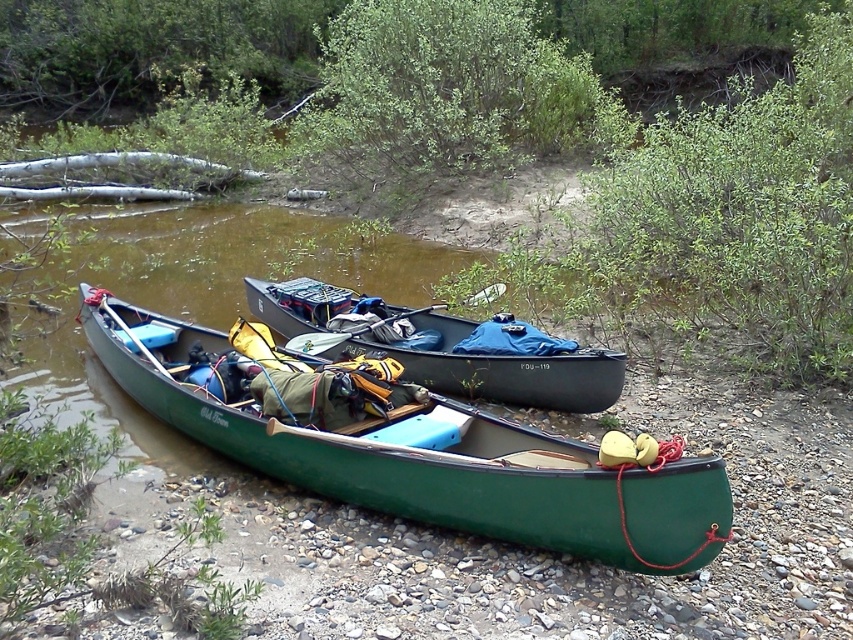
You are a hiker who wants to carry your wooden paddle at center to the nearby store. The path to the store is narrow and has a low clearance. The matte black canoe at center is blocking the path. Can you pass through the path without bending down or dropping the paddle?

The matte black canoe at center is bigger than the wooden paddle at center, so the path might be too narrow for the paddle to pass through without adjusting your grip. However, since the canoe is blocking the path, you might need to move it or find an alternative route.

You are a hiker who just arrived at the riverside and see the green matte canoe at lower left and the white plastic paddle at center. You want to pick up the paddle to load it into the canoe. Which direction should you move relative to the paddle to reach the canoe?

The green matte canoe at lower left is located below the white plastic paddle at center. To reach the canoe from the paddle, you should move downward from the paddle.

You are planning to carry the white plastic paddle at center and the green matte canoe at lower left across a narrow path. Which item should you carry first to ensure they both fit through the path without overlapping?

The green matte canoe at lower left is wider than the white plastic paddle at center, so you should carry the narrower white plastic paddle at center first to ensure both can fit through the narrow path.